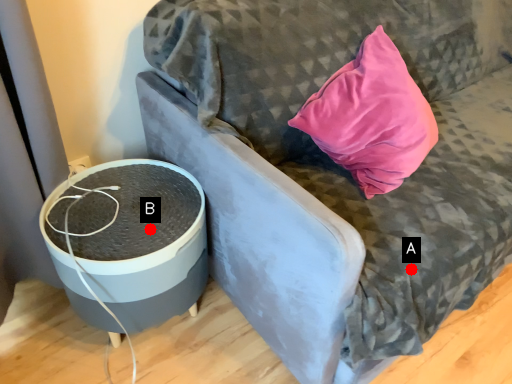
Question: Two points are circled on the image, labeled by A and B beside each circle. Which point is closer to the camera?

Choices:
 (A) A is closer
 (B) B is closer

Answer: (A)